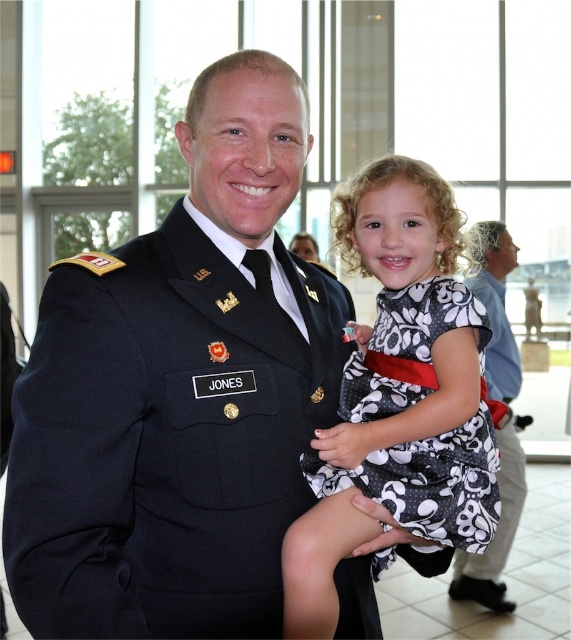
Can you confirm if black dotted fabric dress at center is positioned to the right of black dotted dress at center?

Incorrect, black dotted fabric dress at center is not on the right side of black dotted dress at center.

Between black dotted fabric dress at center and black dotted dress at center, which one has less height?

black dotted fabric dress at center

Who is more distant from viewer, [417,477] or [502,381]?

The point [502,381] is more distant.

Where is `black dotted fabric dress at center`? The width and height of the screenshot is (571, 640). black dotted fabric dress at center is located at coordinates (424, 438).

Which is above, dark blue uniform at center or black dotted fabric dress at center?

Positioned higher is dark blue uniform at center.

Is dark blue uniform at center to the right of black dotted fabric dress at center from the viewer's perspective?

In fact, dark blue uniform at center is to the left of black dotted fabric dress at center.

Where is `dark blue uniform at center`? This screenshot has height=640, width=571. dark blue uniform at center is located at coordinates (179, 392).

Does point (162, 486) come farther from viewer compared to point (493, 579)?

No, (162, 486) is closer to viewer.

Who is positioned more to the right, dark blue uniform at center or black dotted dress at center?

From the viewer's perspective, black dotted dress at center appears more on the right side.

Between point (168, 212) and point (493, 561), which one is positioned in front?

Positioned in front is point (168, 212).

Where is `dark blue uniform at center`? The image size is (571, 640). dark blue uniform at center is located at coordinates (179, 392).